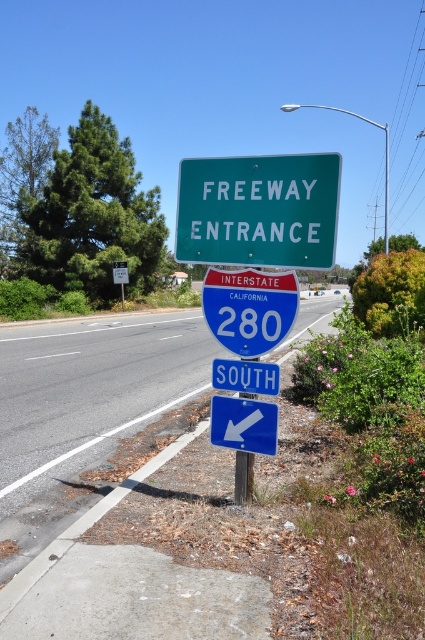
You are a driver approaching the freeway entrance and need to know the distance between the green matte freeway entrance sign at upper center and your car, which is positioned where the camera is. Can you determine if the distance is more than 3 meters?

The green matte freeway entrance sign at upper center and camera are 4.04 meters apart from each other, so the distance is more than 3 meters.

You are a truck driver planning to pass under both the green matte freeway entrance sign at upper center and the blue plastic sign at lower center. The height of your truck is 4.5 meters. Can you safely pass under both signs without hitting them?

The green matte freeway entrance sign at upper center is thinner than the blue plastic sign at lower center, but the exact heights are not provided. Therefore, it is uncertain whether the truck can safely pass under both signs without hitting them.

You are driving and see the green matte freeway entrance sign at upper center and the metallic pole at center. Which object is closer to you?

The green matte freeway entrance sign at upper center is closer to you because it is in front of the metallic pole at center.